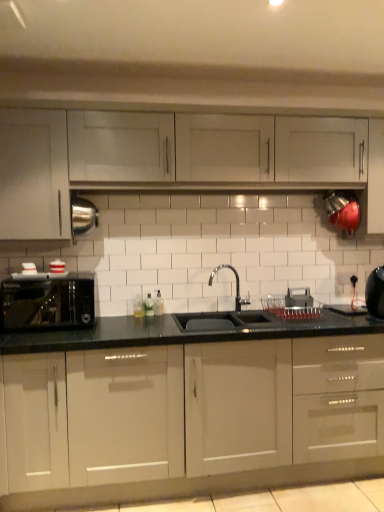
Question: From a real-world perspective, is white plastic electric outlet at center on satin black toaster at left?

Choices:
 (A) no
 (B) yes

Answer: (B)

Question: Is white plastic electric outlet at center located outside satin black toaster at left?

Choices:
 (A) no
 (B) yes

Answer: (B)

Question: From the image's perspective, is white plastic electric outlet at center over satin black toaster at left?

Choices:
 (A) yes
 (B) no

Answer: (A)

Question: Does white plastic electric outlet at center have a larger size compared to satin black toaster at left?

Choices:
 (A) no
 (B) yes

Answer: (A)

Question: Is white plastic electric outlet at center in front of satin black toaster at left?

Choices:
 (A) no
 (B) yes

Answer: (A)

Question: Does white plastic electric outlet at center have a greater height compared to satin black toaster at left?

Choices:
 (A) yes
 (B) no

Answer: (B)

Question: Considering the relative sizes of black glossy kettle at right and glossy white cabinets at center, the first cabinetry in the bottom-to-top sequence, in the image provided, is black glossy kettle at right thinner than glossy white cabinets at center, the first cabinetry in the bottom-to-top sequence,?

Choices:
 (A) no
 (B) yes

Answer: (B)

Question: Is black glossy kettle at right not within glossy white cabinets at center, the 3th cabinetry from the top?

Choices:
 (A) no
 (B) yes

Answer: (B)

Question: Can you confirm if black glossy kettle at right is bigger than glossy white cabinets at center, the 3th cabinetry from the top?

Choices:
 (A) yes
 (B) no

Answer: (B)

Question: Does black glossy kettle at right have a lesser height compared to glossy white cabinets at center, the 3th cabinetry from the top?

Choices:
 (A) no
 (B) yes

Answer: (B)

Question: From the image's perspective, is black glossy kettle at right on top of glossy white cabinets at center, the first cabinetry in the bottom-to-top sequence?

Choices:
 (A) no
 (B) yes

Answer: (B)

Question: Could you tell me if black glossy kettle at right is facing glossy white cabinets at center, the 3th cabinetry from the top?

Choices:
 (A) no
 (B) yes

Answer: (A)

Question: From the image's perspective, is white plastic electric outlet at center over glossy white cabinets at center, the first cabinetry in the bottom-to-top sequence?

Choices:
 (A) yes
 (B) no

Answer: (A)